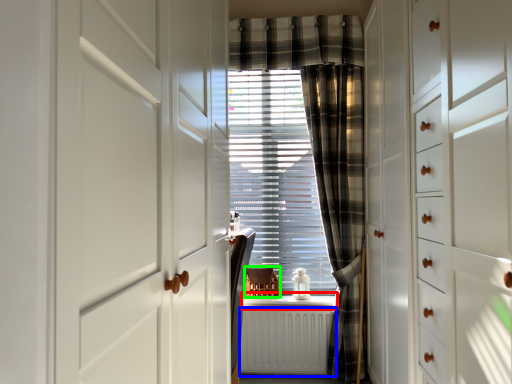
Question: Considering the real-world distances, which object is farthest from window sill (highlighted by a red box)? radiator (highlighted by a blue box) or furniture (highlighted by a green box)?

Choices:
 (A) radiator
 (B) furniture

Answer: (A)